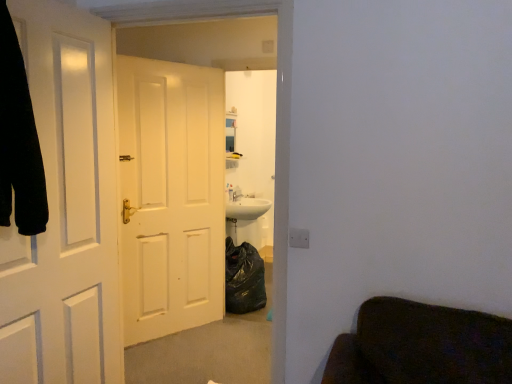
Identify the location of vacant space underneath white matte door at center, positioned as the 1th door in back-to-front order (from a real-world perspective). (170, 330).